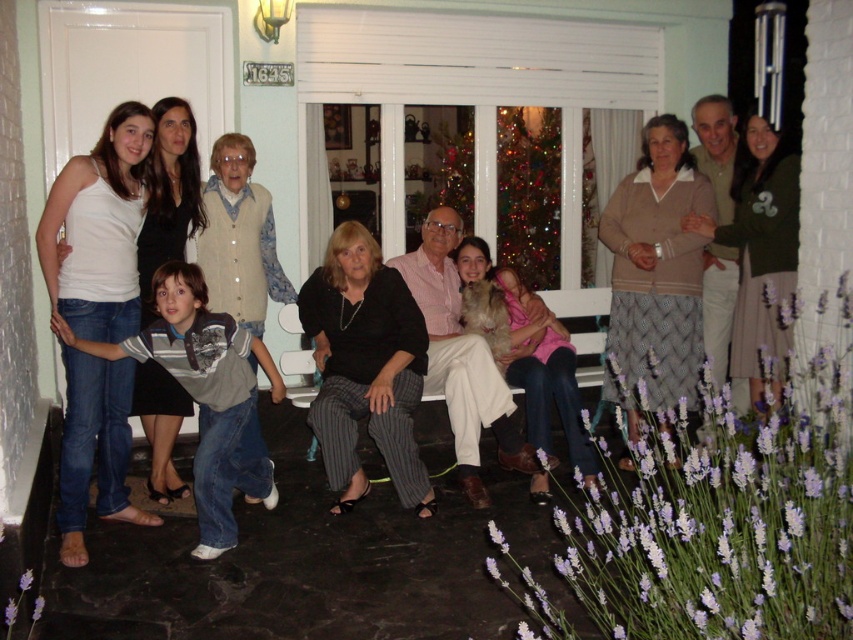
You are a photographer trying to capture a group photo of the matte black jacket at center and the light brown sweater at upper right in the scene. The camera you are using has a maximum focus range of 2 meters. Will both subjects be in focus?

The matte black jacket at center and light brown sweater at upper right are 1.90 meters apart from each other. Since the distance between them is within the camera maximum focus range of 2 meters, both subjects will be in focus.

You are a photographer taking a picture of the purple floral bush at lower right and the matte black sweater at center. Which object should you focus on first if you want to capture both in focus?

The purple floral bush at lower right is below the matte black sweater at center, so focusing on the matte black sweater at center first would ensure both are in focus as the sweater is closer to the camera.

You are standing at the entrance of the house and see a point marked at coordinates (x=213, y=522). Which object is this point located on?

The point at coordinates (x=213, y=522) is located on the matte black jacket at center.